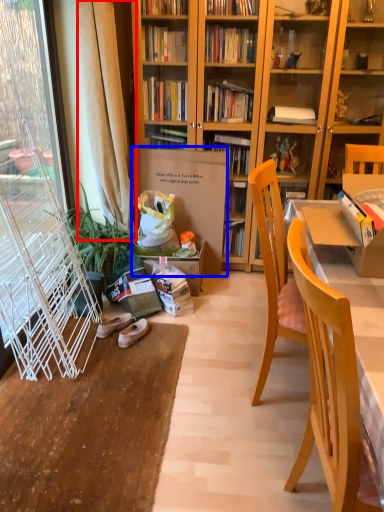
Question: Which object appears farthest to the camera in this image, curtain (highlighted by a red box) or cardboard box (highlighted by a blue box)?

Choices:
 (A) curtain
 (B) cardboard box

Answer: (B)